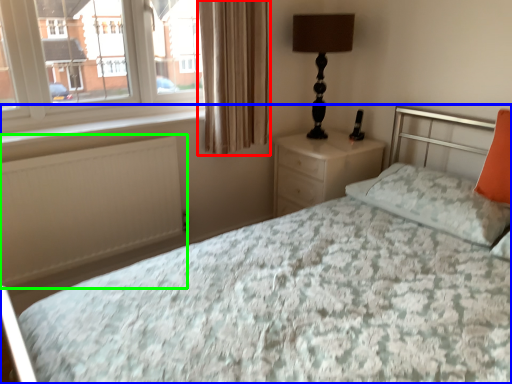
Question: Which object is positioned farthest from curtain (highlighted by a red box)? Select from bed (highlighted by a blue box) and radiator (highlighted by a green box).

Choices:
 (A) bed
 (B) radiator

Answer: (B)